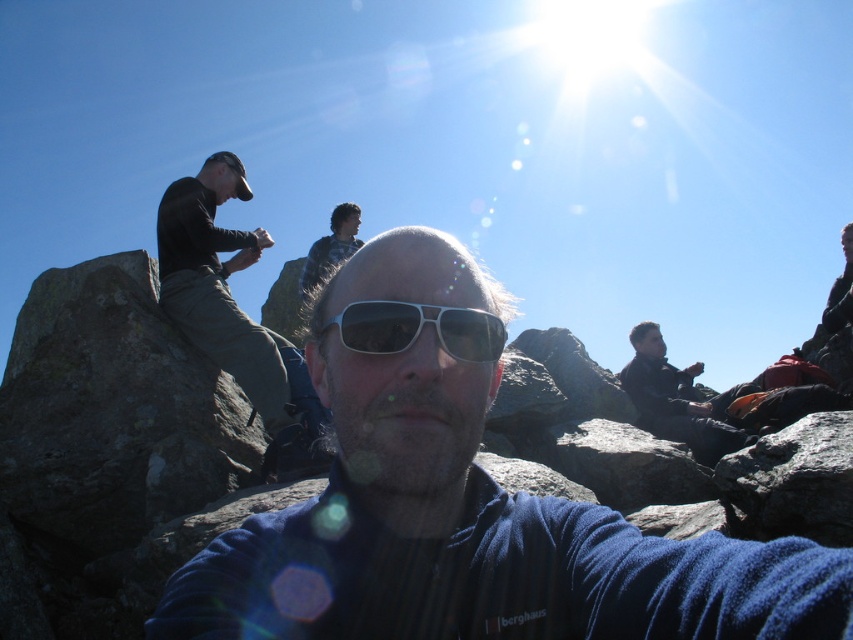
Does blue fabric shirt at center appear on the left side of dark blue jacket at right?

Yes, blue fabric shirt at center is to the left of dark blue jacket at right.

Describe the element at coordinates (468, 516) in the screenshot. I see `blue fabric shirt at center` at that location.

What do you see at coordinates (468, 516) in the screenshot?
I see `blue fabric shirt at center` at bounding box center [468, 516].

Find the location of `blue fabric shirt at center`. blue fabric shirt at center is located at coordinates (468, 516).

Is dark blue jacket at right wider than plaid shirt at center?

Indeed, dark blue jacket at right has a greater width compared to plaid shirt at center.

Is point (723, 392) less distant than point (334, 236)?

Yes.

What do you see at coordinates (676, 400) in the screenshot? This screenshot has height=640, width=853. I see `dark blue jacket at right` at bounding box center [676, 400].

You are a GUI agent. You are given a task and a screenshot of the screen. Output one action in this format:
    pyautogui.click(x=<x>, y=<y>)
    Task: Click on the dark blue jacket at right
    
    Given the screenshot: What is the action you would take?
    pyautogui.click(x=676, y=400)

Does dark green fabric pants at left lie in front of plaid shirt at center?

That is True.

Is dark green fabric pants at left wider than plaid shirt at center?

Correct, the width of dark green fabric pants at left exceeds that of plaid shirt at center.

Between point (300, 419) and point (320, 272), which one is positioned behind?

Positioned behind is point (320, 272).

Find the location of a particular element. dark green fabric pants at left is located at coordinates click(227, 296).